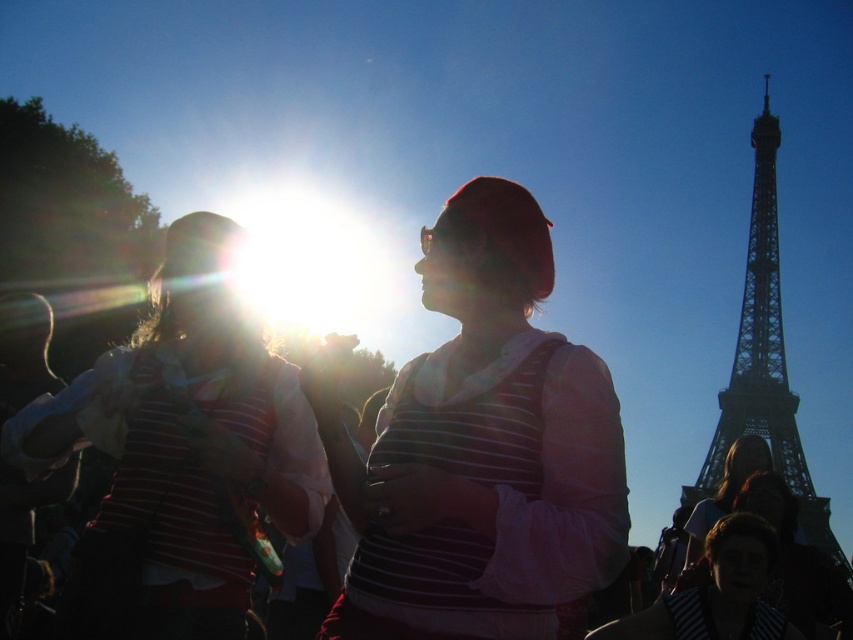
You are standing at the Eiffel Tower and want to take a photo of a specific point in the scene. The point you want to focus on is located at coordinates point (585, 566). Considering your camera has a depth of field that can clearly capture objects up to 200 meters away, will the point be in focus?

The distance of point (585, 566) from the camera is 206.09 meters, which exceeds the camera depth of field limit of 200 meters. Therefore, the point will not be in focus.

You are a photographer trying to capture a clear shot of both the matte striped shirt at center and the striped fabric shirt at center. Based on their positions, which one is blocking the view of the other?

The matte striped shirt at center is blocking the view of the striped fabric shirt at center because it is positioned in front of it.